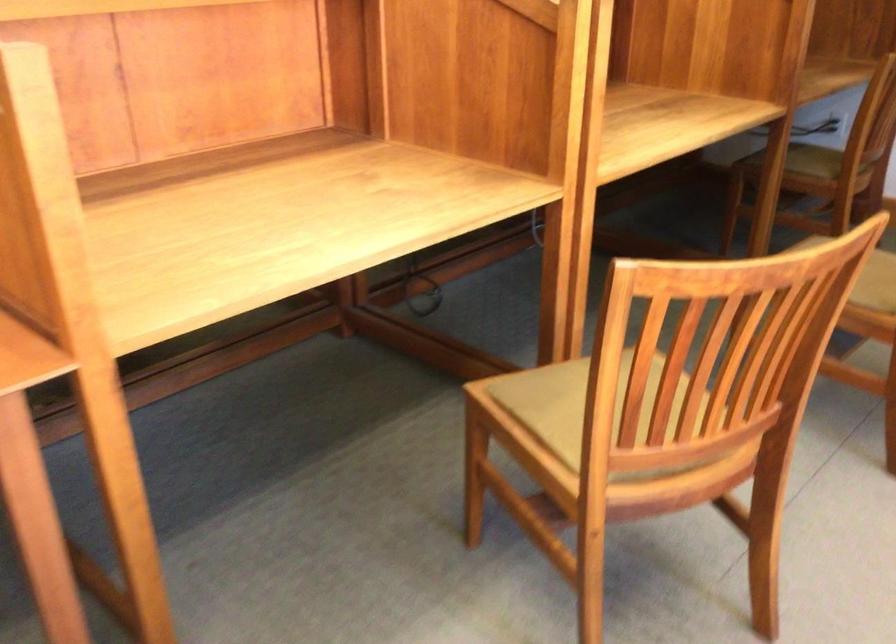
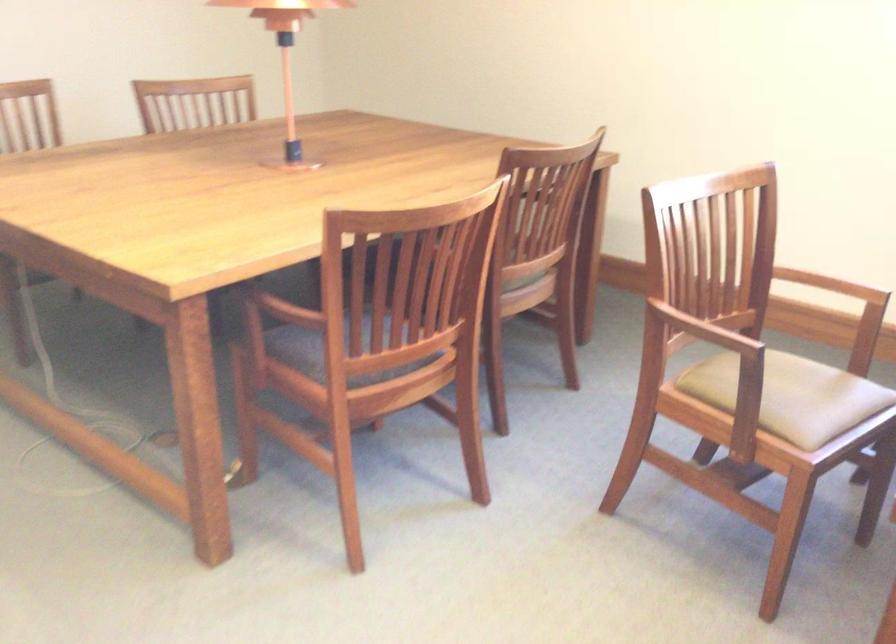
How did the camera likely rotate?

The rotation direction of the camera is right-down.